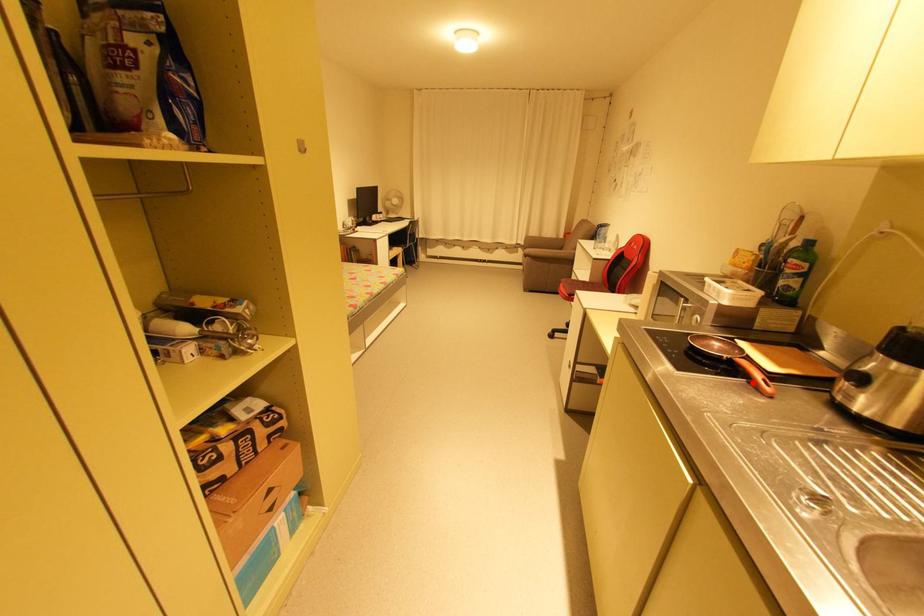
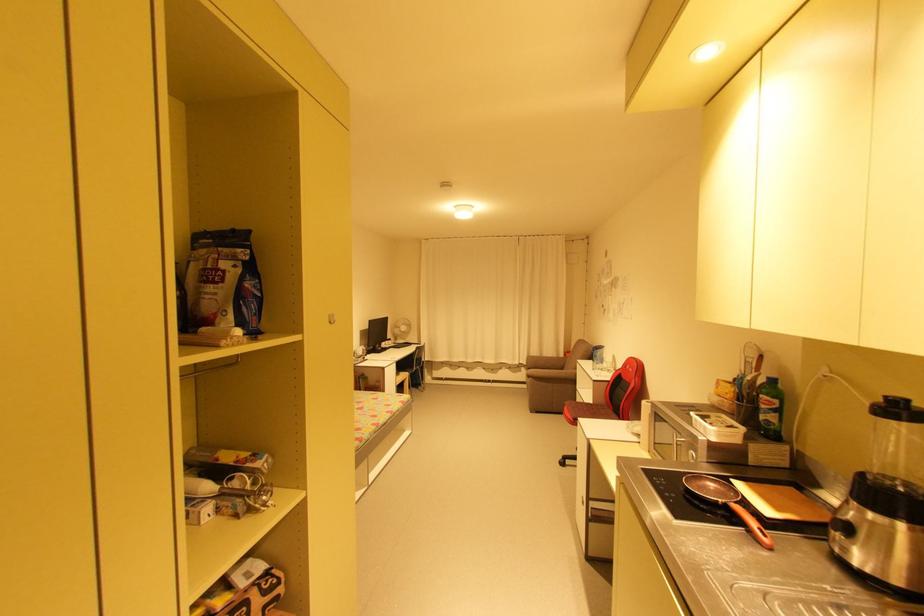
Find the pixel in the second image that matches the highlighted location in the first image.

(751, 532)